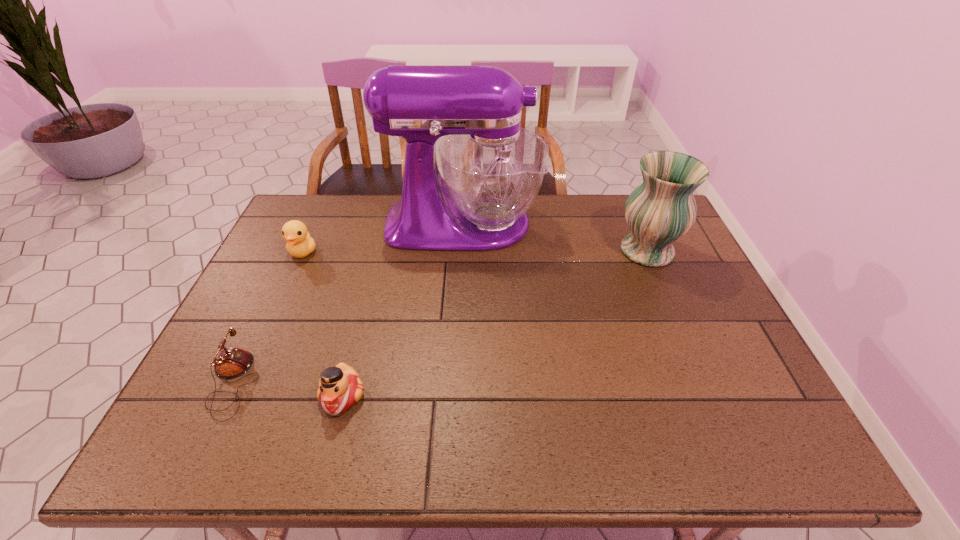
You are a GUI agent. You are given a task and a screenshot of the screen. Output one action in this format:
    pyautogui.click(x=<x>, y=<y>)
    Task: Click on the vacant space at the far edge of the desktop
    
    Given the screenshot: What is the action you would take?
    pyautogui.click(x=355, y=211)

The image size is (960, 540). In the image, there is a desktop. In order to click on free region at the near edge in this screenshot , I will do `click(339, 440)`.

Locate an element on the screen. free space at the left edge is located at coordinates (276, 349).

Image resolution: width=960 pixels, height=540 pixels. In order to click on free space at the far left corner in this screenshot , I will do `click(280, 235)`.

Image resolution: width=960 pixels, height=540 pixels. I want to click on free region at the near left corner of the desktop, so tap(171, 439).

Find the location of a particular element. This screenshot has width=960, height=540. vacant region at the near right corner of the desktop is located at coordinates (781, 458).

At what (x,y) coordinates should I click in order to perform the action: click on free space between the second tallest object and the right duck. Please return your answer as a coordinate pair (x, y). The height and width of the screenshot is (540, 960). Looking at the image, I should click on (494, 323).

You are a GUI agent. You are given a task and a screenshot of the screen. Output one action in this format:
    pyautogui.click(x=<x>, y=<y>)
    Task: Click on the empty space between the right duck and the vase
    
    Given the screenshot: What is the action you would take?
    pyautogui.click(x=494, y=323)

Identify the location of free space between the right duck and the farther duck. The image size is (960, 540). (323, 324).

The height and width of the screenshot is (540, 960). I want to click on free point between the second tallest object and the mixer, so [555, 237].